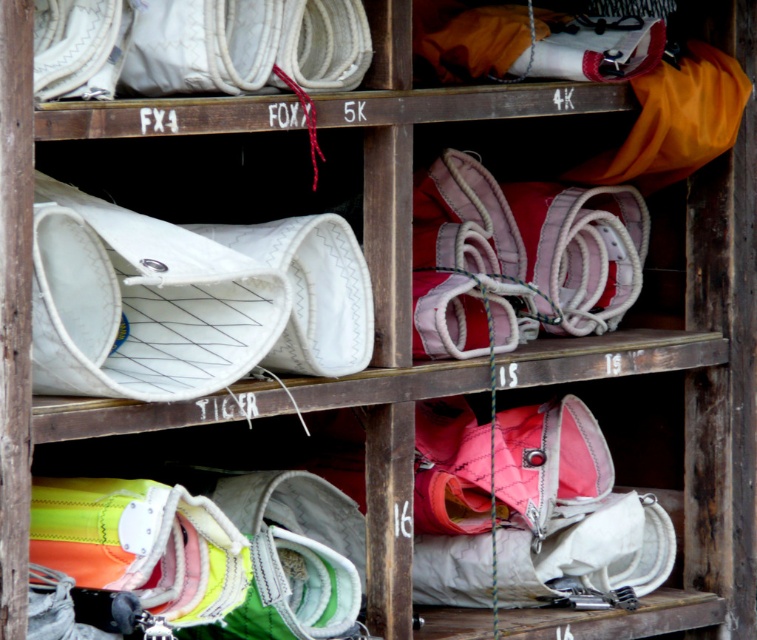
Can you confirm if pink fabric shoe at center is shorter than white fabric shoe at center?

No, pink fabric shoe at center is not shorter than white fabric shoe at center.

Can you confirm if pink fabric shoe at center is positioned above white fabric shoe at center?

Correct, pink fabric shoe at center is located above white fabric shoe at center.

Who is more forward, (578, 317) or (360, 316)?

Point (360, 316) is more forward.

Identify the location of pink fabric shoe at center. This screenshot has height=640, width=757. pos(519,257).